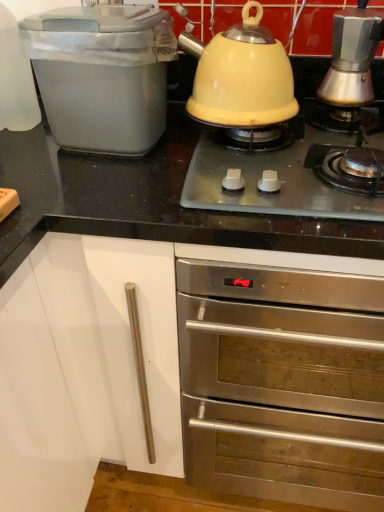
Question: Is matte plastic bread bin at left, the 1th kitchen appliance viewed from the left, outside of yellow enameled kettle at upper center?

Choices:
 (A) no
 (B) yes

Answer: (B)

Question: Is yellow enameled kettle at upper center at the back of matte plastic bread bin at left, the 1th kitchen appliance viewed from the left?

Choices:
 (A) no
 (B) yes

Answer: (A)

Question: Is matte plastic bread bin at left, acting as the 2th kitchen appliance starting from the right, surrounding yellow enameled kettle at upper center?

Choices:
 (A) no
 (B) yes

Answer: (A)

Question: Considering the relative positions of matte plastic bread bin at left, the 1th kitchen appliance viewed from the left, and yellow enameled kettle at upper center in the image provided, is matte plastic bread bin at left, the 1th kitchen appliance viewed from the left, to the left of yellow enameled kettle at upper center from the viewer's perspective?

Choices:
 (A) yes
 (B) no

Answer: (A)

Question: From the image's perspective, is matte plastic bread bin at left, the 1th kitchen appliance viewed from the left, beneath yellow enameled kettle at upper center?

Choices:
 (A) yes
 (B) no

Answer: (B)

Question: In terms of size, does silver metallic espresso maker at upper right, the second kitchen appliance viewed from the left, appear bigger or smaller than yellow enameled kettle at upper center?

Choices:
 (A) big
 (B) small

Answer: (B)

Question: From their relative heights in the image, would you say silver metallic espresso maker at upper right, the 1th kitchen appliance viewed from the right, is taller or shorter than yellow enameled kettle at upper center?

Choices:
 (A) short
 (B) tall

Answer: (B)

Question: Is point (360, 66) positioned closer to the camera than point (314, 185)?

Choices:
 (A) farther
 (B) closer

Answer: (A)

Question: In terms of width, does silver metallic espresso maker at upper right, the 1th kitchen appliance viewed from the right, look wider or thinner when compared to yellow enameled kettle at upper center?

Choices:
 (A) wide
 (B) thin

Answer: (B)

Question: Is point (66, 24) positioned closer to the camera than point (266, 78)?

Choices:
 (A) closer
 (B) farther

Answer: (A)

Question: Would you say matte plastic bread bin at left, acting as the 2th kitchen appliance starting from the right, is inside or outside yellow matte kettle at center?

Choices:
 (A) inside
 (B) outside

Answer: (B)

Question: Is matte plastic bread bin at left, the 1th kitchen appliance viewed from the left, in front of or behind yellow matte kettle at center in the image?

Choices:
 (A) behind
 (B) front

Answer: (A)

Question: Is matte plastic bread bin at left, acting as the 2th kitchen appliance starting from the right, taller or shorter than yellow matte kettle at center?

Choices:
 (A) short
 (B) tall

Answer: (B)

Question: Is yellow matte kettle at center bigger or smaller than silver metallic espresso maker at upper right, the 1th kitchen appliance viewed from the right?

Choices:
 (A) small
 (B) big

Answer: (B)

Question: Looking at their shapes, would you say yellow matte kettle at center is wider or thinner than silver metallic espresso maker at upper right, the second kitchen appliance viewed from the left?

Choices:
 (A) thin
 (B) wide

Answer: (B)